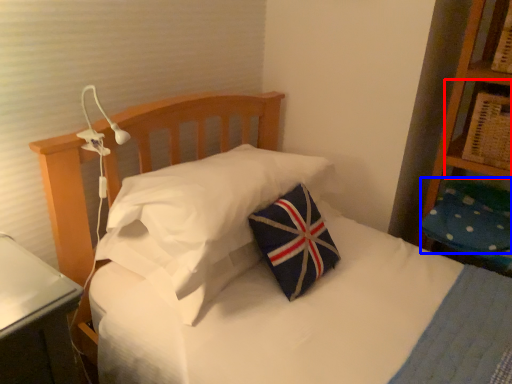
Question: Among these objects, which one is farthest to the camera, shelf (highlighted by a red box) or pillow (highlighted by a blue box)?

Choices:
 (A) shelf
 (B) pillow

Answer: (B)